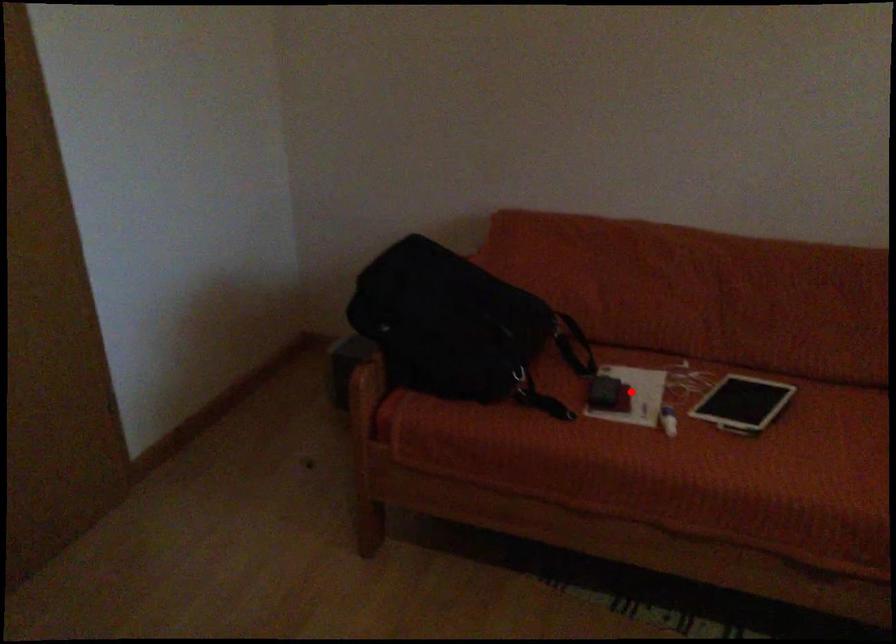
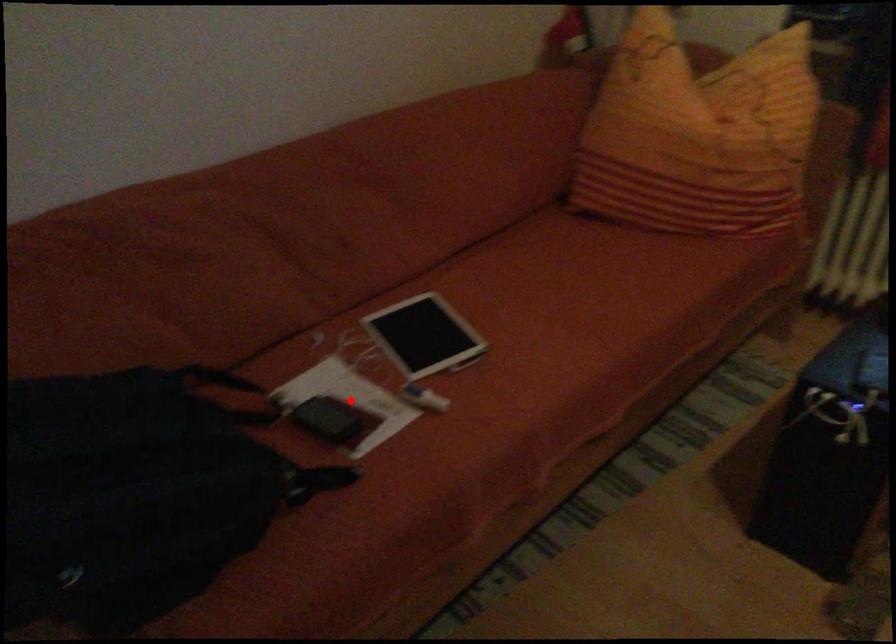
I am providing you with two images of the same scene from different viewpoints. A red point is marked on the first image and another point is marked on the second image. Is the red point in image1 aligned with the point shown in image2?

Yes